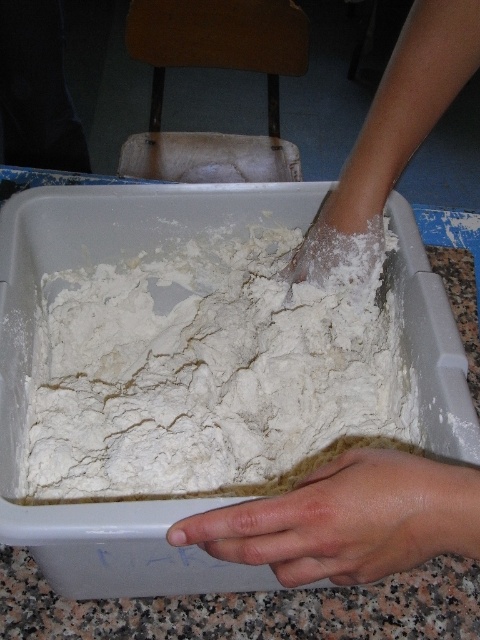
From the picture: You are a chef preparing dough. You have a white powdery flour at center and a dry skin at lower center in your mixing container. Which ingredient is higher in the container?

The white powdery flour at center is above the dry skin at lower center in the container.

You are a chef trying to locate the white powdery flour at center in the image. According to the coordinates provided, where exactly is it positioned?

The white powdery flour at center is positioned at coordinates point (211, 372).

In the scene shown: You are a chef preparing dough in the rectangular plastic container. You notice two points marked in the image. One is at point (166, 451) and the other at point (322, 496). If you were to draw a straight line between these two points, would the line pass through the rectangular plastic container?

Point (166, 451) is behind point (322, 496), so the line between them would pass through the rectangular plastic container.